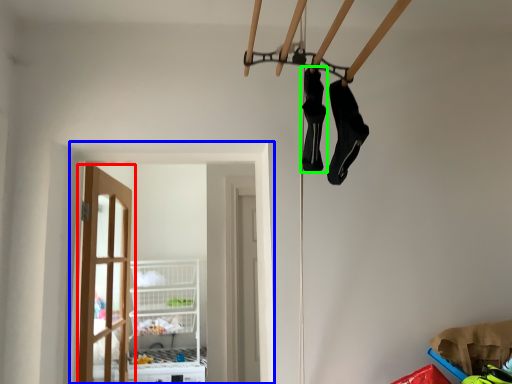
Question: Based on their relative distances, which object is farther from door (highlighted by a red box)? Choose from window (highlighted by a blue box) and footwear (highlighted by a green box).

Choices:
 (A) window
 (B) footwear

Answer: (B)